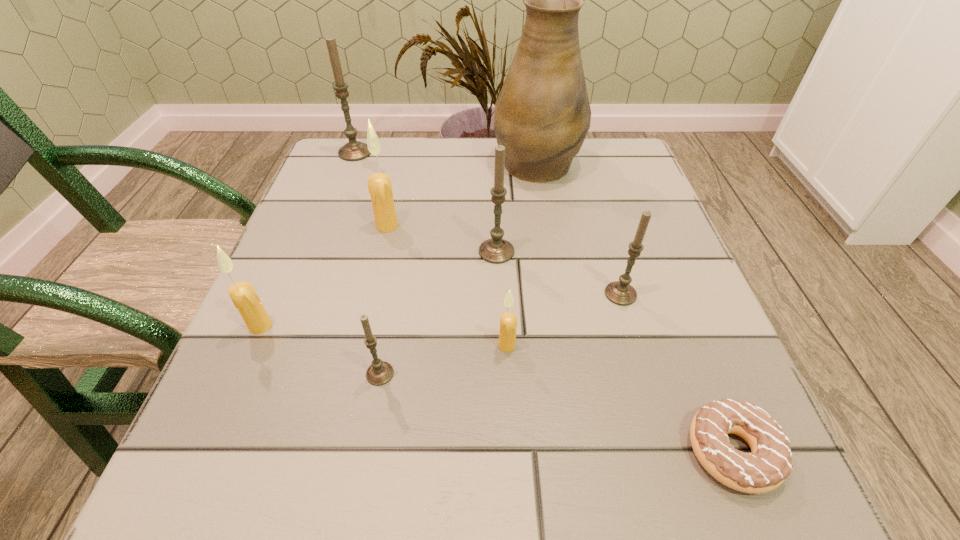
I want to click on pitcher, so [x=542, y=115].

Locate an element on the screen. This screenshot has height=540, width=960. the biggest gray candle is located at coordinates (354, 150).

The image size is (960, 540). In order to click on the second tallest object in this screenshot , I will do `click(354, 150)`.

Locate an element on the screen. The image size is (960, 540). the biggest cream candle is located at coordinates (379, 184).

Locate an element on the screen. The height and width of the screenshot is (540, 960). the second cream candle from right to left is located at coordinates (379, 184).

The image size is (960, 540). I want to click on the third gray candle from left to right, so click(x=496, y=250).

The image size is (960, 540). I want to click on the sixth nearest object, so click(496, 250).

Image resolution: width=960 pixels, height=540 pixels. Identify the location of the second smallest cream candle. (243, 295).

The height and width of the screenshot is (540, 960). Identify the location of the sixth farthest object. (243, 295).

I want to click on the rightmost gray candle, so click(620, 292).